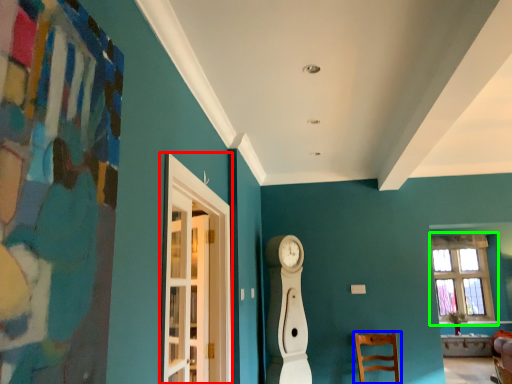
Question: Estimate the real-world distances between objects in this image. Which object is farther from glass door (highlighted by a red box), chair (highlighted by a blue box) or window (highlighted by a green box)?

Choices:
 (A) chair
 (B) window

Answer: (B)